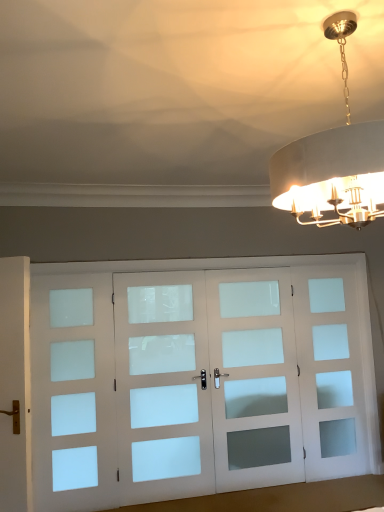
Question: From a real-world perspective, relative to white frosted glass screen door at center, arranged as the 2th screen door when viewed from the right, is white frosted glass screen door at left, marked as the 4th screen door in a right-to-left arrangement, vertically above or below?

Choices:
 (A) below
 (B) above

Answer: (A)

Question: Looking at their shapes, would you say white frosted glass screen door at left, marked as the 4th screen door in a right-to-left arrangement, is wider or thinner than white frosted glass screen door at center, the 3th screen door from the left?

Choices:
 (A) wide
 (B) thin

Answer: (B)

Question: Which is farther from the metallic gold chandelier at upper right?

Choices:
 (A) white frosted glass screen door at left, which is the 1th screen door from left to right
 (B) white frosted glass screen door at center, arranged as the 2th screen door when viewed from the right
 (C) white frosted glass screen door at right, the fourth screen door when ordered from left to right
 (D) white frosted glass door at center, acting as the second screen door starting from the left

Answer: (A)

Question: Based on their relative distances, which object is farther from the white frosted glass door at center, which is the third screen door from right to left?

Choices:
 (A) white frosted glass screen door at right, the fourth screen door when ordered from left to right
 (B) metallic gold chandelier at upper right
 (C) white frosted glass screen door at center, the 3th screen door from the left
 (D) white frosted glass screen door at left, which is the 1th screen door from left to right

Answer: (B)